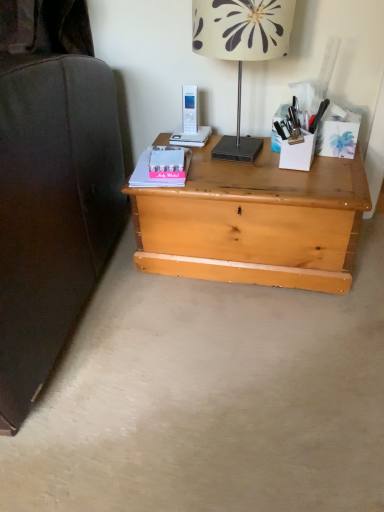
Where is `vacant space positioned to the left of white plastic pen holder at upper right`? vacant space positioned to the left of white plastic pen holder at upper right is located at coordinates (239, 160).